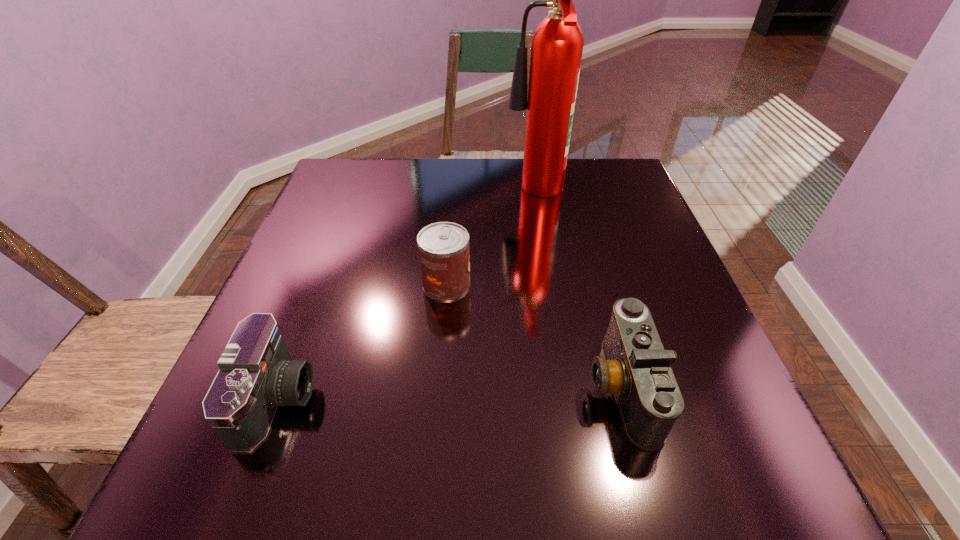
Identify the location of free spot between the right camera and the left camera. (449, 392).

The width and height of the screenshot is (960, 540). I want to click on free spot between the second farthest object and the left camera, so click(362, 341).

At what (x,y) coordinates should I click in order to perform the action: click on vacant space that is in between the third nearest object and the left camera. Please return your answer as a coordinate pair (x, y). The width and height of the screenshot is (960, 540). Looking at the image, I should click on (362, 341).

At what (x,y) coordinates should I click in order to perform the action: click on unoccupied area between the leftmost object and the right camera. Please return your answer as a coordinate pair (x, y). Looking at the image, I should click on (449, 392).

Locate an element on the screen. The height and width of the screenshot is (540, 960). vacant space that is in between the third object from right to left and the leftmost object is located at coordinates (362, 341).

You are a GUI agent. You are given a task and a screenshot of the screen. Output one action in this format:
    pyautogui.click(x=<x>, y=<y>)
    Task: Click on the blank region between the right camera and the can
    
    Given the screenshot: What is the action you would take?
    pyautogui.click(x=534, y=335)

At what (x,y) coordinates should I click in order to perform the action: click on the third closest object to the right camera. Please return your answer as a coordinate pair (x, y). Looking at the image, I should click on (256, 374).

Identify which object is the second nearest to the right camera. Please provide its 2D coordinates. Your answer should be formatted as a tuple, i.e. [(x, y)], where the tuple contains the x and y coordinates of a point satisfying the conditions above.

[(557, 44)]

Where is `vacant region that satisfies the following two spatial constraints: 1. on the front side of the can; 2. on the front-facing side of the left camera`? Image resolution: width=960 pixels, height=540 pixels. vacant region that satisfies the following two spatial constraints: 1. on the front side of the can; 2. on the front-facing side of the left camera is located at coordinates (437, 399).